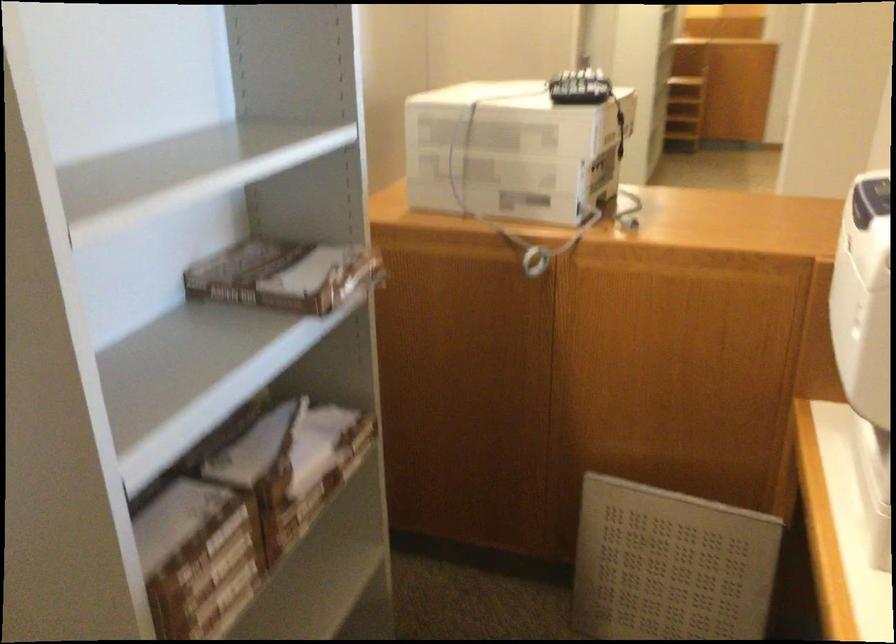
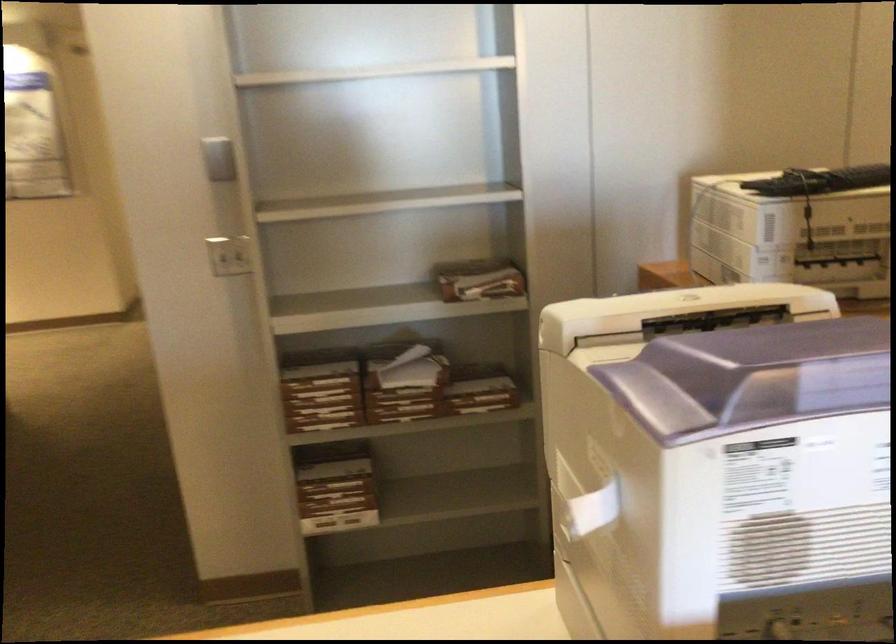
In the second image, find the point that corresponds to the point at 590,93 in the first image.

(820, 181)